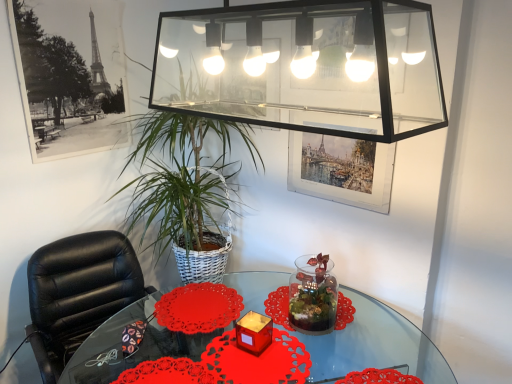
Question: Is translucent glass candle at center at the left side of black leather chair at left?

Choices:
 (A) no
 (B) yes

Answer: (A)

Question: Does translucent glass candle at center lie in front of black leather chair at left?

Choices:
 (A) no
 (B) yes

Answer: (A)

Question: From the image's perspective, would you say translucent glass candle at center is positioned over black leather chair at left?

Choices:
 (A) yes
 (B) no

Answer: (A)

Question: From a real-world perspective, is translucent glass candle at center located higher than black leather chair at left?

Choices:
 (A) no
 (B) yes

Answer: (B)

Question: Could you tell me if translucent glass candle at center is turned towards black leather chair at left?

Choices:
 (A) yes
 (B) no

Answer: (B)

Question: Considering the positions of red paper doily at center and translucent glass candle at center in the image, is red paper doily at center taller or shorter than translucent glass candle at center?

Choices:
 (A) short
 (B) tall

Answer: (A)

Question: In the image, is red paper doily at center on the left side or the right side of translucent glass candle at center?

Choices:
 (A) right
 (B) left

Answer: (B)

Question: In terms of size, does red paper doily at center appear bigger or smaller than translucent glass candle at center?

Choices:
 (A) small
 (B) big

Answer: (B)

Question: From the image's perspective, relative to translucent glass candle at center, is red paper doily at center above or below?

Choices:
 (A) below
 (B) above

Answer: (B)

Question: Based on their positions, is red paper doily at center located to the left or right of black leather chair at left?

Choices:
 (A) right
 (B) left

Answer: (A)

Question: From the image's perspective, is red paper doily at center above or below black leather chair at left?

Choices:
 (A) above
 (B) below

Answer: (A)

Question: Looking at their shapes, would you say red paper doily at center is wider or thinner than black leather chair at left?

Choices:
 (A) wide
 (B) thin

Answer: (B)

Question: In terms of height, does red paper doily at center look taller or shorter compared to black leather chair at left?

Choices:
 (A) tall
 (B) short

Answer: (B)

Question: Is point (276, 281) closer or farther from the camera than point (77, 109)?

Choices:
 (A) closer
 (B) farther

Answer: (B)

Question: Considering the positions of transparent glass table at center and black paper picture frame at upper left, placed as the 1th picture frame when sorted from left to right, in the image, is transparent glass table at center bigger or smaller than black paper picture frame at upper left, placed as the 1th picture frame when sorted from left to right,?

Choices:
 (A) big
 (B) small

Answer: (A)